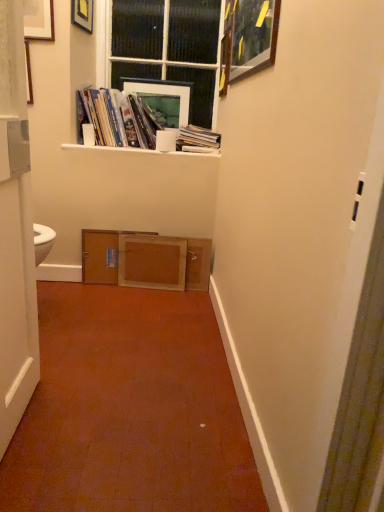
Question: Considering the relative positions of white matte toilet paper at upper center and wooden picture frame at upper right, the 3th picture frame positioned from the left, in the image provided, is white matte toilet paper at upper center behind wooden picture frame at upper right, the 3th picture frame positioned from the left,?

Choices:
 (A) no
 (B) yes

Answer: (B)

Question: Can you confirm if white matte toilet paper at upper center is positioned to the right of wooden picture frame at upper right, arranged as the 1th picture frame when viewed from the front?

Choices:
 (A) no
 (B) yes

Answer: (A)

Question: From a real-world perspective, is white matte toilet paper at upper center below wooden picture frame at upper right, the 3th picture frame positioned from the left?

Choices:
 (A) no
 (B) yes

Answer: (B)

Question: From the image's perspective, is white matte toilet paper at upper center on wooden picture frame at upper right, arranged as the 1th picture frame when viewed from the front?

Choices:
 (A) yes
 (B) no

Answer: (B)

Question: Is white matte toilet paper at upper center facing away from wooden picture frame at upper right, arranged as the 1th picture frame when viewed from the front?

Choices:
 (A) no
 (B) yes

Answer: (A)

Question: From a real-world perspective, is white paper stack at upper center, which ranks as the first book in right-to-left order, above or below black glass window at upper center?

Choices:
 (A) above
 (B) below

Answer: (B)

Question: Would you say white paper stack at upper center, which is the 2th book in left-to-right order, is inside or outside black glass window at upper center?

Choices:
 (A) inside
 (B) outside

Answer: (B)

Question: In terms of height, does white paper stack at upper center, which is the 2th book in left-to-right order, look taller or shorter compared to black glass window at upper center?

Choices:
 (A) short
 (B) tall

Answer: (A)

Question: In terms of width, does white paper stack at upper center, which ranks as the first book in right-to-left order, look wider or thinner when compared to black glass window at upper center?

Choices:
 (A) thin
 (B) wide

Answer: (B)

Question: Considering the positions of white paper stack at upper center, which ranks as the first book in right-to-left order, and matte paper books at upper center, the 2th book when ordered from right to left, in the image, is white paper stack at upper center, which ranks as the first book in right-to-left order, wider or thinner than matte paper books at upper center, the 2th book when ordered from right to left,?

Choices:
 (A) wide
 (B) thin

Answer: (A)

Question: Would you say white paper stack at upper center, which is the 2th book in left-to-right order, is to the left or to the right of matte paper books at upper center, the 1th book in the left-to-right sequence, in the picture?

Choices:
 (A) right
 (B) left

Answer: (A)

Question: Would you say white paper stack at upper center, which is the 2th book in left-to-right order, is inside or outside matte paper books at upper center, the 1th book in the left-to-right sequence?

Choices:
 (A) outside
 (B) inside

Answer: (A)

Question: From the image's perspective, is white paper stack at upper center, which ranks as the first book in right-to-left order, located above or below matte paper books at upper center, the 1th book in the left-to-right sequence?

Choices:
 (A) below
 (B) above

Answer: (A)

Question: Is white matte shelf at upper center spatially inside white matte toilet paper at upper center, or outside of it?

Choices:
 (A) inside
 (B) outside

Answer: (B)

Question: Based on their sizes in the image, would you say white matte shelf at upper center is bigger or smaller than white matte toilet paper at upper center?

Choices:
 (A) small
 (B) big

Answer: (B)